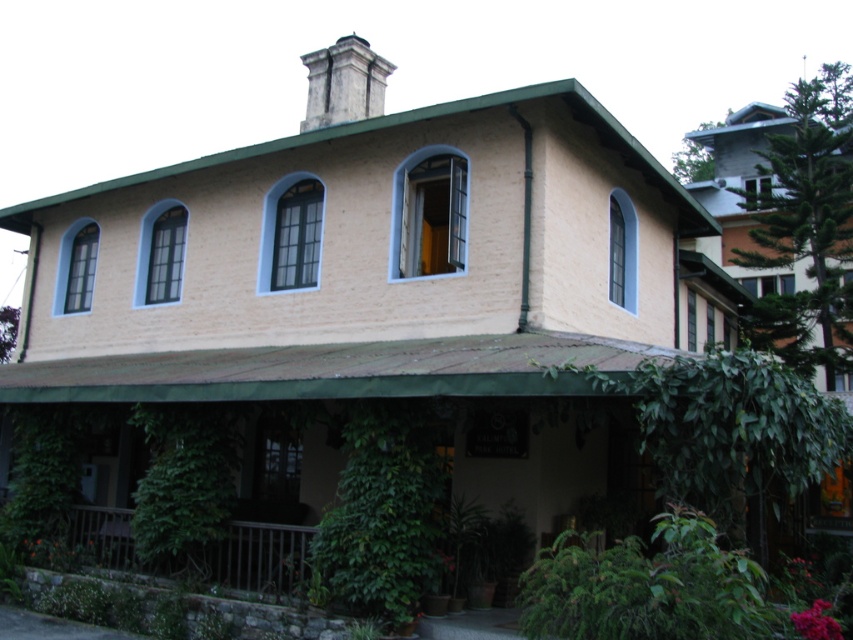
Is point (415, 449) farther from viewer compared to point (96, 524)?

That is False.

Does green leafy plant at lower center have a lesser height compared to brown wooden porch at lower left?

No.

Image resolution: width=853 pixels, height=640 pixels. What do you see at coordinates (381, 513) in the screenshot? I see `green leafy plant at lower center` at bounding box center [381, 513].

Locate an element on the screen. green leafy plant at lower center is located at coordinates (381, 513).